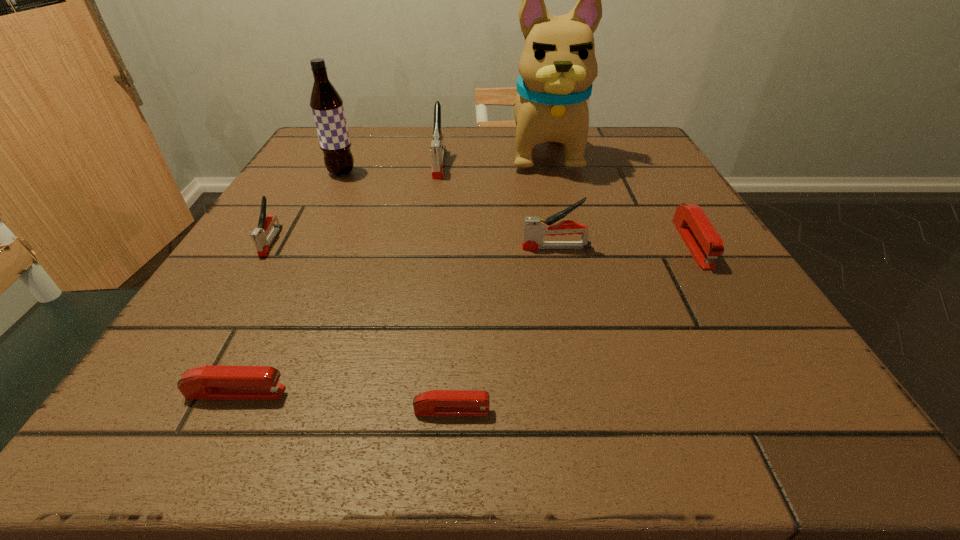
The height and width of the screenshot is (540, 960). I want to click on free spot between the beige puppy and the smallest gray stapler, so click(408, 196).

The image size is (960, 540). Identify the location of free space between the smallest red stapler and the farthest red stapler. (572, 327).

The width and height of the screenshot is (960, 540). I want to click on empty location between the second tallest object and the leftmost object, so click(x=306, y=207).

Identify the location of empty space between the fifth stapler from right to left and the smallest red stapler. (344, 401).

Identify the location of free point between the biggest gray stapler and the second nearest red stapler. [338, 278].

Locate an element on the screen. free space between the brown root beer and the second smallest red stapler is located at coordinates (289, 282).

Identify the location of vacant area that lies between the biggest gray stapler and the fifth shortest object. (498, 205).

Locate an element on the screen. The width and height of the screenshot is (960, 540). vacant area that lies between the third tallest stapler and the root beer is located at coordinates (306, 207).

Where is `the seventh closest object relative to the second farthest red stapler`? the seventh closest object relative to the second farthest red stapler is located at coordinates (704, 243).

Locate an element on the screen. Image resolution: width=960 pixels, height=540 pixels. object that is the fifth closest to the fifth stapler from right to left is located at coordinates (437, 148).